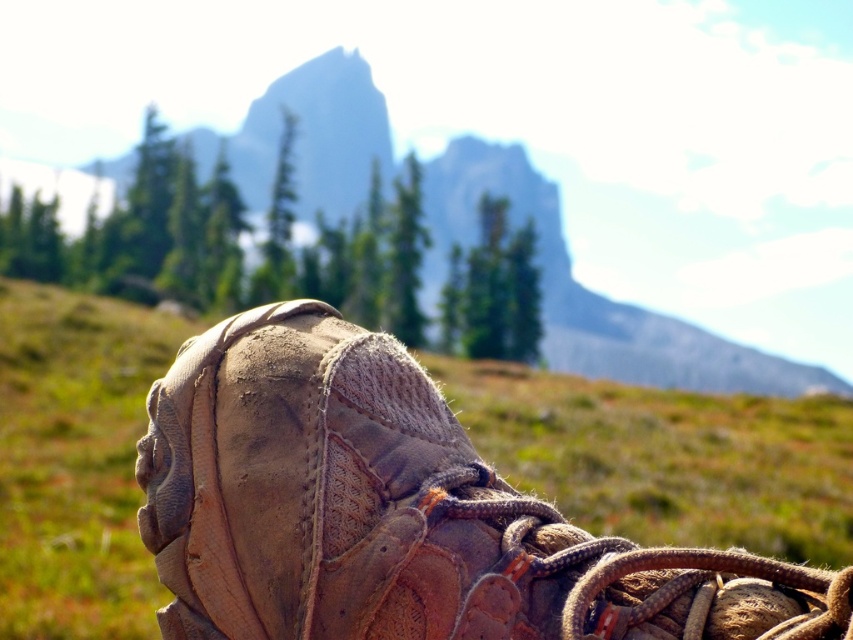
Question: Does leather boot at center have a larger size compared to brown leather boot at center?

Choices:
 (A) yes
 (B) no

Answer: (A)

Question: From the image, what is the correct spatial relationship of leather boot at center in relation to brown leather boot at center?

Choices:
 (A) left
 (B) right

Answer: (B)

Question: Considering the relative positions of leather boot at center and brown leather boot at center in the image provided, where is leather boot at center located with respect to brown leather boot at center?

Choices:
 (A) left
 (B) right

Answer: (B)

Question: Which of the following is the farthest from the observer?

Choices:
 (A) brown leather boot at center
 (B) leather boot at center

Answer: (A)

Question: Which point appears closest to the camera in this image?

Choices:
 (A) (428, 416)
 (B) (637, 344)

Answer: (A)